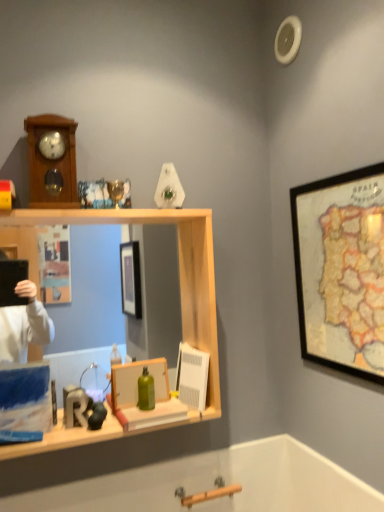
Question: Is blue matte box at left looking in the opposite direction of wooden framed map at upper right, placed as the 1th picture frame when sorted from right to left?

Choices:
 (A) no
 (B) yes

Answer: (A)

Question: Can you confirm if blue matte box at left is smaller than wooden framed map at upper right, positioned as the second picture frame in bottom-to-top order?

Choices:
 (A) yes
 (B) no

Answer: (A)

Question: Considering the relative positions of blue matte box at left and wooden framed map at upper right, the second picture frame in the left-to-right sequence, in the image provided, is blue matte box at left to the right of wooden framed map at upper right, the second picture frame in the left-to-right sequence, from the viewer's perspective?

Choices:
 (A) yes
 (B) no

Answer: (B)

Question: Could you tell me if blue matte box at left is turned towards wooden framed map at upper right, the second picture frame in the left-to-right sequence?

Choices:
 (A) yes
 (B) no

Answer: (B)

Question: Is blue matte box at left shorter than wooden framed map at upper right, the second picture frame in the left-to-right sequence?

Choices:
 (A) yes
 (B) no

Answer: (A)

Question: Is point (382, 344) closer or farther from the camera than point (125, 396)?

Choices:
 (A) closer
 (B) farther

Answer: (A)

Question: Considering the positions of wooden framed map at upper right, placed as the 1th picture frame when sorted from right to left, and matte wooden picture frame at center, the 1th picture frame viewed from the left, in the image, is wooden framed map at upper right, placed as the 1th picture frame when sorted from right to left, bigger or smaller than matte wooden picture frame at center, the 1th picture frame viewed from the left,?

Choices:
 (A) small
 (B) big

Answer: (B)

Question: From a real-world perspective, is wooden framed map at upper right, positioned as the second picture frame in bottom-to-top order, positioned above or below matte wooden picture frame at center, the 2th picture frame in the top-to-bottom sequence?

Choices:
 (A) above
 (B) below

Answer: (A)

Question: From the image's perspective, is wooden framed map at upper right, the first picture frame in the top-to-bottom sequence, positioned above or below matte wooden picture frame at center, placed as the 1th picture frame when sorted from bottom to top?

Choices:
 (A) below
 (B) above

Answer: (B)

Question: From the image's perspective, relative to matte wooden picture frame at center, the 1th picture frame viewed from the left, is green matte bottle at center above or below?

Choices:
 (A) above
 (B) below

Answer: (A)

Question: Choose the correct answer: Is green matte bottle at center inside matte wooden picture frame at center, placed as the 1th picture frame when sorted from bottom to top, or outside it?

Choices:
 (A) outside
 (B) inside

Answer: (A)

Question: In terms of size, does green matte bottle at center appear bigger or smaller than matte wooden picture frame at center, placed as the 1th picture frame when sorted from bottom to top?

Choices:
 (A) small
 (B) big

Answer: (A)

Question: From their relative heights in the image, would you say green matte bottle at center is taller or shorter than matte wooden picture frame at center, which is counted as the second picture frame, starting from the right?

Choices:
 (A) tall
 (B) short

Answer: (B)

Question: From a real-world perspective, relative to matte wooden picture frame at center, placed as the 1th picture frame when sorted from bottom to top, is blue matte box at left vertically above or below?

Choices:
 (A) below
 (B) above

Answer: (B)

Question: From the image's perspective, relative to matte wooden picture frame at center, placed as the 1th picture frame when sorted from bottom to top, is blue matte box at left above or below?

Choices:
 (A) above
 (B) below

Answer: (B)